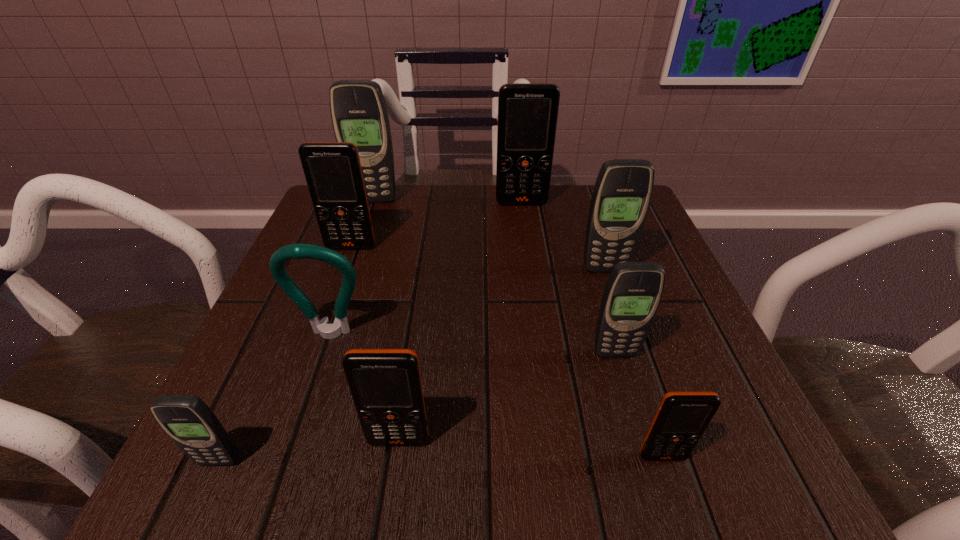
This screenshot has height=540, width=960. Find the location of `the biggest orange cellular telephone`. the biggest orange cellular telephone is located at coordinates (527, 112).

The width and height of the screenshot is (960, 540). Find the location of `the second orange cellular telephone from right to left`. the second orange cellular telephone from right to left is located at coordinates (527, 112).

Find the location of a particular element. Image resolution: width=960 pixels, height=540 pixels. the farthest gray cellular telephone is located at coordinates (359, 114).

The image size is (960, 540). I want to click on the third smallest orange cellular telephone, so click(x=333, y=173).

Identify the location of the third farthest cellular telephone. The width and height of the screenshot is (960, 540). (333, 173).

This screenshot has height=540, width=960. I want to click on the third nearest gray cellular telephone, so click(621, 197).

Locate an element on the screen. The width and height of the screenshot is (960, 540). the fifth nearest cellular telephone is located at coordinates (621, 197).

Locate an element on the screen. Image resolution: width=960 pixels, height=540 pixels. the fifth farthest object is located at coordinates (293, 251).

Find the location of `bottle opener`. bottle opener is located at coordinates (293, 251).

Locate an element on the screen. The height and width of the screenshot is (540, 960). the third farthest gray cellular telephone is located at coordinates (633, 291).